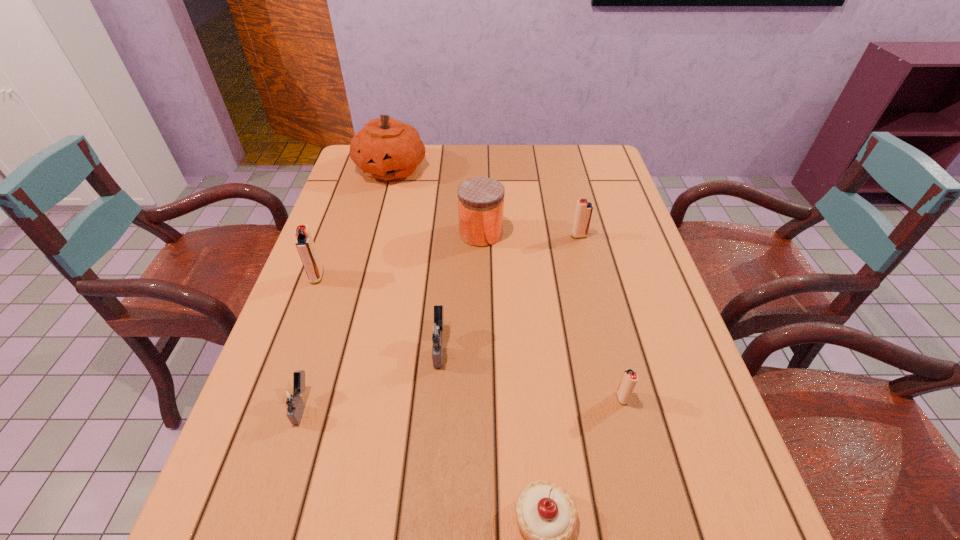
Where is `pumpkin at the left edge`? This screenshot has width=960, height=540. pumpkin at the left edge is located at coordinates (387, 149).

Where is `object located at the far left corner`? object located at the far left corner is located at coordinates (387, 149).

This screenshot has height=540, width=960. In the image, there is a desktop. What are the coordinates of `vacant space at the far edge` in the screenshot? It's located at (436, 146).

At what (x,y) coordinates should I click in order to perform the action: click on vacant space at the left edge of the desktop. Please return your answer as a coordinate pair (x, y). The width and height of the screenshot is (960, 540). Looking at the image, I should click on (357, 259).

Where is `blank area at the right edge`? blank area at the right edge is located at coordinates (604, 226).

This screenshot has height=540, width=960. I want to click on free spot at the far right corner of the desktop, so click(x=580, y=166).

Image resolution: width=960 pixels, height=540 pixels. Identify the location of vacant point located between the orange jar and the farthest red igniter. (530, 234).

Find the location of a particular element. free spot between the orange pumpkin and the left gray igniter is located at coordinates (347, 286).

This screenshot has width=960, height=540. I want to click on vacant area between the nearest red igniter and the second biggest red igniter, so click(x=601, y=317).

At what (x,y) coordinates should I click in order to perform the action: click on the fourth closest object to the orange pumpkin. Please return your answer as a coordinate pair (x, y). Image resolution: width=960 pixels, height=540 pixels. Looking at the image, I should click on (438, 331).